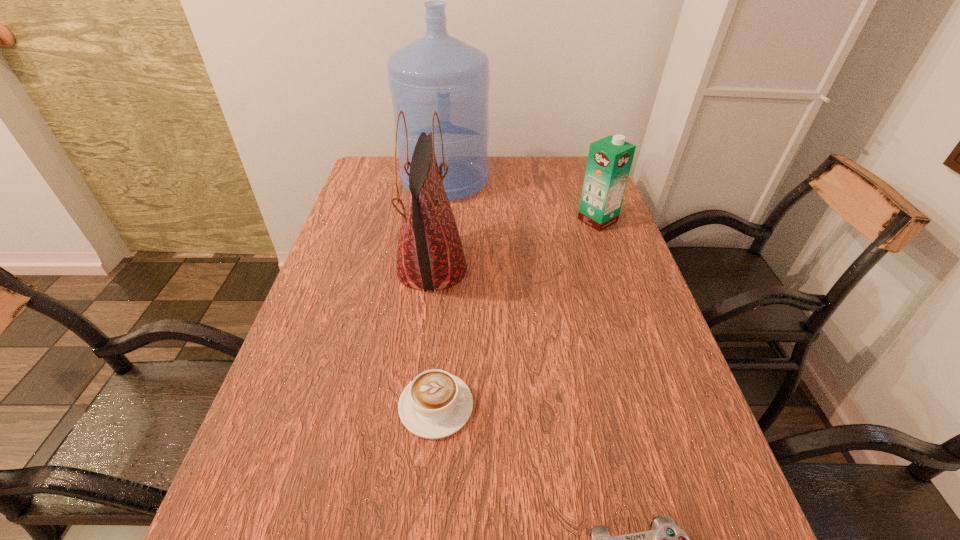
Find the location of a particular element. The width and height of the screenshot is (960, 540). the farthest object is located at coordinates (437, 72).

Locate an element on the screen. water jug is located at coordinates (437, 72).

Identify the location of handbag. Image resolution: width=960 pixels, height=540 pixels. (430, 256).

This screenshot has width=960, height=540. What are the coordinates of `the fourth shortest object` in the screenshot? It's located at coord(430,256).

The image size is (960, 540). In order to click on carton in this screenshot , I will do `click(609, 162)`.

You are a GUI agent. You are given a task and a screenshot of the screen. Output one action in this format:
    pyautogui.click(x=<x>, y=<y>)
    Task: Click on the second farthest object
    The width and height of the screenshot is (960, 540).
    Given the screenshot: What is the action you would take?
    pyautogui.click(x=609, y=162)

The width and height of the screenshot is (960, 540). I want to click on cappuccino, so click(x=436, y=404).

Locate an element on the screen. vacant region located 0.060m on the front of the third farthest object is located at coordinates (424, 327).

Identify the location of free space located on the left of the carton. (511, 220).

Locate an element on the screen. The image size is (960, 540). free region located 0.160m with the handle on the right side of the second nearest object is located at coordinates [556, 406].